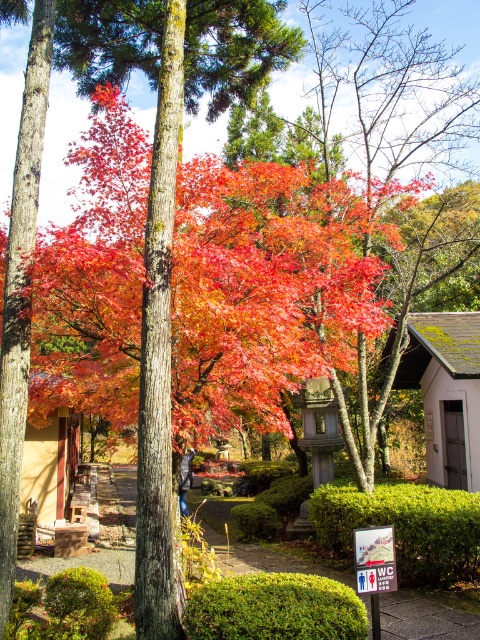
You are a visitor walking along the paved pathway in the Japanese garden scene. You see a green mossy wood hut at right and a green leafy hedge at lower left. Which object is positioned to the right of the other?

The green mossy wood hut at right is to the right of the green leafy hedge at lower left.

You are a gardener planning to trim both the green leafy hedge at lower center and the green leafy hedge at lower left. Based on their sizes, which hedge will require more time and effort to maintain?

The green leafy hedge at lower center requires more time and effort to maintain because it is bigger than the green leafy hedge at lower left.